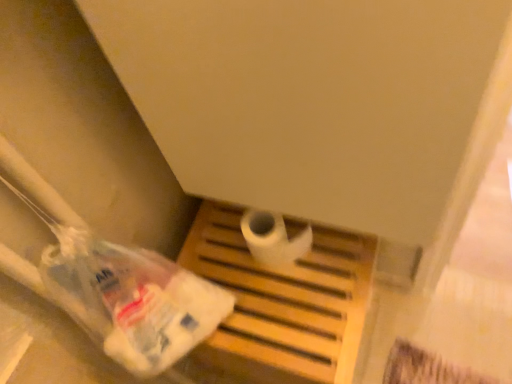
You are a GUI agent. You are given a task and a screenshot of the screen. Output one action in this format:
    pyautogui.click(x=<x>, y=<y>)
    Task: Click on the free space above wooden tray at center (from a real-world perspective)
    The image size is (512, 384).
    Given the screenshot: What is the action you would take?
    pyautogui.click(x=267, y=263)